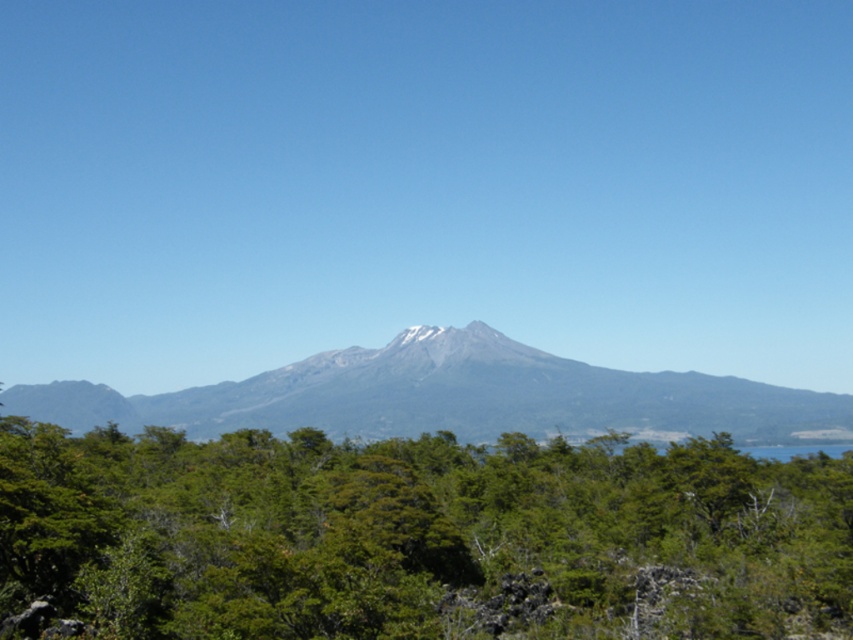
Looking at this image, you are standing at the point marked by the coordinates point [415,538] in the image. What is the nearest object to you?

The point [415,538] marks green leafy tree at center, so the nearest object to you is the green leafy tree at center.